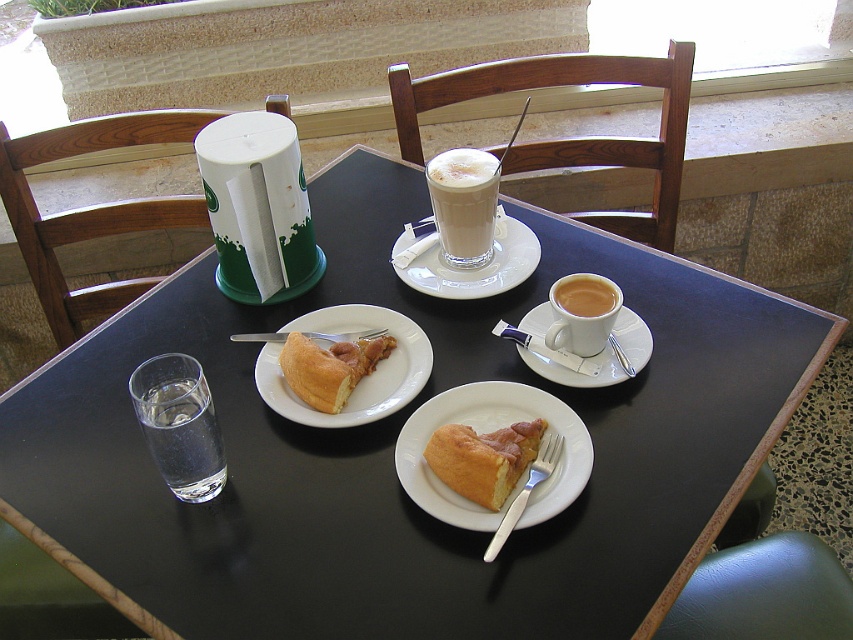
Question: Is golden flaky pastry at center thinner than matte white cup at upper right?

Choices:
 (A) no
 (B) yes

Answer: (A)

Question: Is foamy white latte at center below white ceramic saucer at center?

Choices:
 (A) no
 (B) yes

Answer: (A)

Question: Which point is farther to the camera?

Choices:
 (A) yellow cake at center
 (B) white ceramic saucer at center

Answer: (B)

Question: Which point is closer to the camera taking this photo?

Choices:
 (A) (556, 289)
 (B) (184, 422)

Answer: (B)

Question: Estimate the real-world distances between objects in this image. Which object is farther from the foamy white latte at center?

Choices:
 (A) matte white cup at center right
 (B) white ceramic saucer at center right
 (C) matte white plate at center

Answer: (C)

Question: Can you confirm if white ceramic saucer at center is positioned above matte white cup at center right?

Choices:
 (A) no
 (B) yes

Answer: (B)